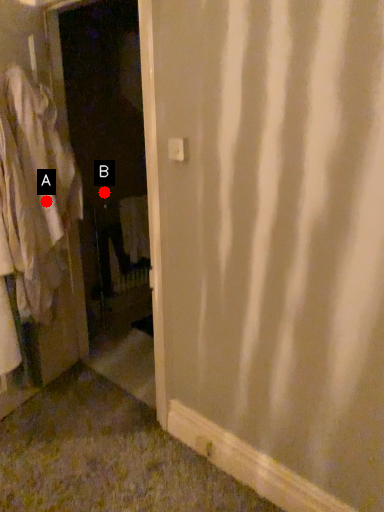
Question: Two points are circled on the image, labeled by A and B beside each circle. Which point is farther to the camera?

Choices:
 (A) A is further
 (B) B is further

Answer: (B)